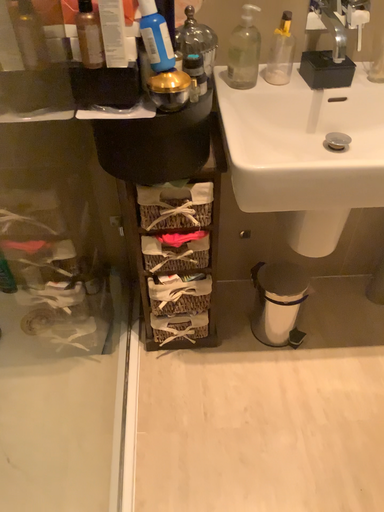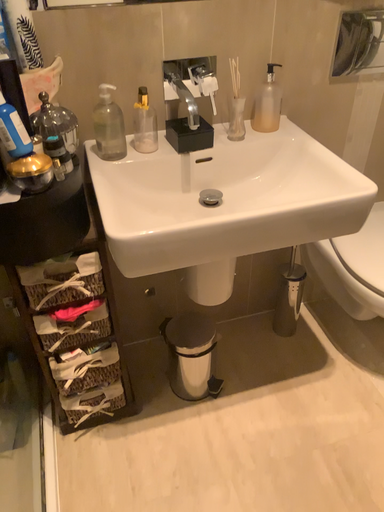
Question: Which way did the camera rotate in the video?

Choices:
 (A) rotated upward
 (B) rotated downward

Answer: (A)